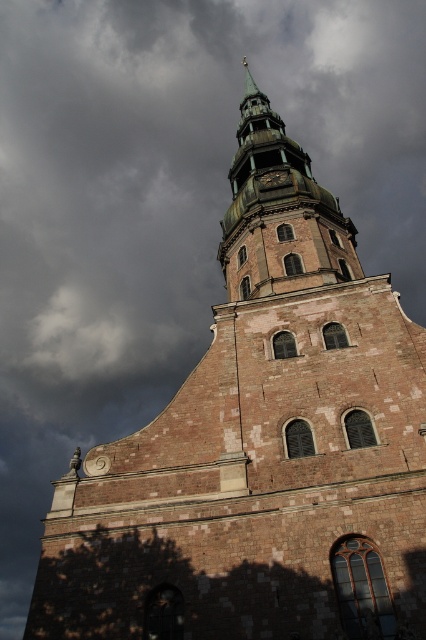
Can you confirm if brick steeple at upper center is thinner than dark brown wooden clock at center?

Incorrect, brick steeple at upper center's width is not less than dark brown wooden clock at center's.

Does brick steeple at upper center have a greater width compared to dark brown wooden clock at center?

Correct, the width of brick steeple at upper center exceeds that of dark brown wooden clock at center.

Find the location of a particular element. Image resolution: width=426 pixels, height=640 pixels. brick steeple at upper center is located at coordinates (279, 212).

You are a GUI agent. You are given a task and a screenshot of the screen. Output one action in this format:
    pyautogui.click(x=<x>, y=<y>)
    Task: Click on the brick steeple at upper center
    
    Given the screenshot: What is the action you would take?
    pyautogui.click(x=279, y=212)